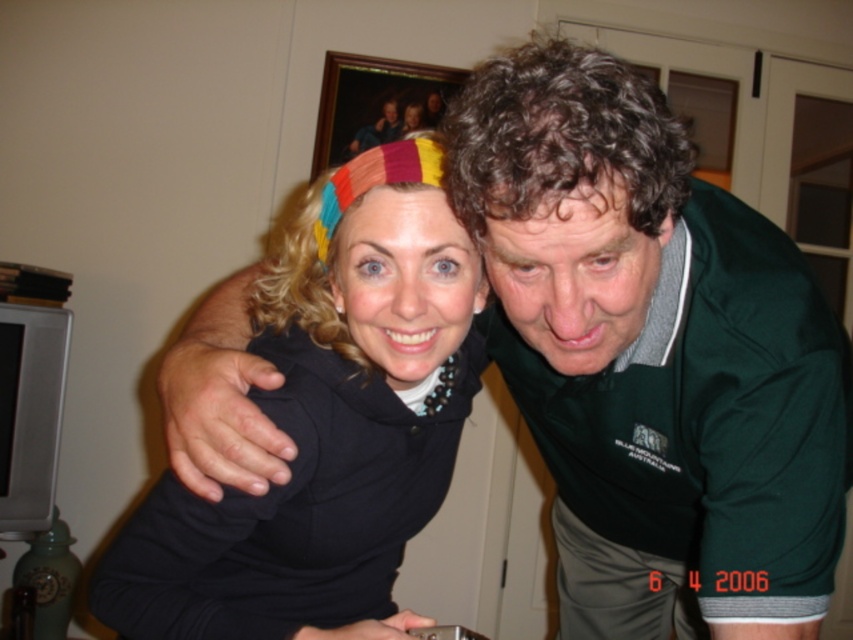
Question: Does black matte headband at upper center have a greater width compared to rainbow fabric headband at upper center?

Choices:
 (A) no
 (B) yes

Answer: (B)

Question: Which of the following is the closest to the observer?

Choices:
 (A) (306, 600)
 (B) (428, 188)

Answer: (B)

Question: Is black matte headband at upper center smaller than rainbow fabric headband at upper center?

Choices:
 (A) yes
 (B) no

Answer: (B)

Question: Which of the following is the closest to the observer?

Choices:
 (A) (310, 378)
 (B) (445, 236)

Answer: (B)

Question: Considering the relative positions of black matte headband at upper center and rainbow fabric headband at upper center in the image provided, where is black matte headband at upper center located with respect to rainbow fabric headband at upper center?

Choices:
 (A) below
 (B) above

Answer: (A)